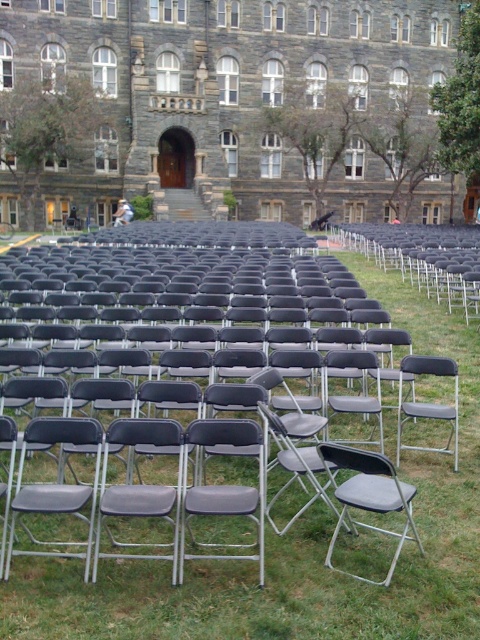
Question: Does matte black chair at center have a greater width compared to gray matte folding chair at center?

Choices:
 (A) yes
 (B) no

Answer: (A)

Question: Which of these objects is positioned closest to the matte black chair at center?

Choices:
 (A) gray fabric folding chair at center
 (B) green grass at center
 (C) gray matte folding chair at center
 (D) matte gray folding chair at center

Answer: (B)

Question: Which object is positioned closest to the gray matte folding chair at center?

Choices:
 (A) matte black chair at center
 (B) green grass at center

Answer: (B)

Question: Does gray matte folding chair at center appear under gray fabric folding chair at center?

Choices:
 (A) no
 (B) yes

Answer: (B)

Question: Is green grass at center positioned at the back of matte gray folding chair at center?

Choices:
 (A) yes
 (B) no

Answer: (B)

Question: Which point is farther to the camera?

Choices:
 (A) (464, 621)
 (B) (348, 515)
 (C) (402, 390)
 (D) (206, 422)

Answer: (C)